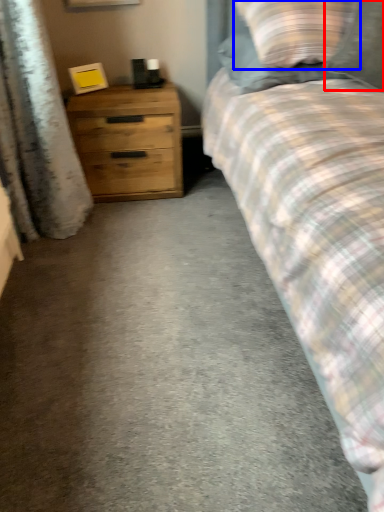
Question: Which object is further to the camera taking this photo, pillow (highlighted by a red box) or pillow (highlighted by a blue box)?

Choices:
 (A) pillow
 (B) pillow

Answer: (B)